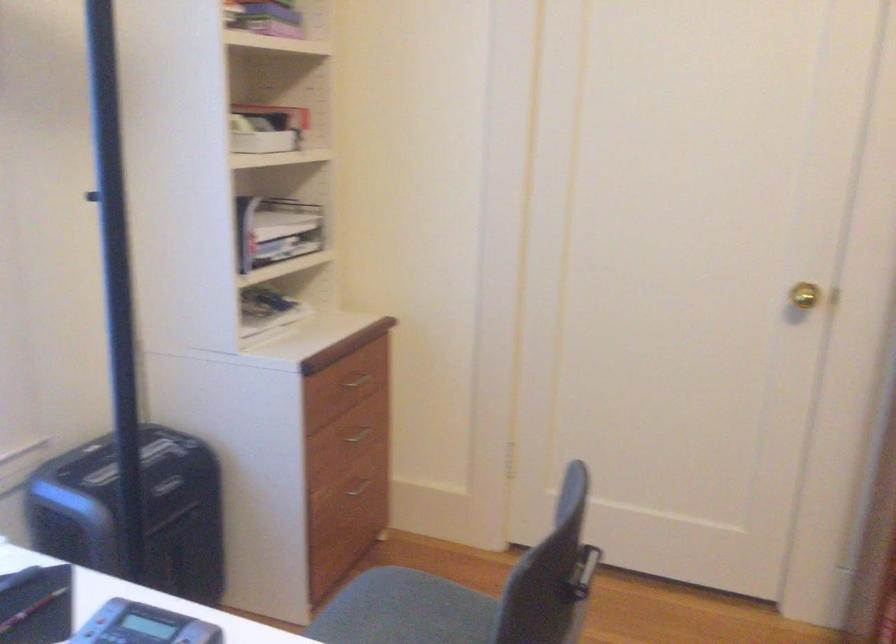
This screenshot has width=896, height=644. What do you see at coordinates (804, 295) in the screenshot? I see `the gold door knob` at bounding box center [804, 295].